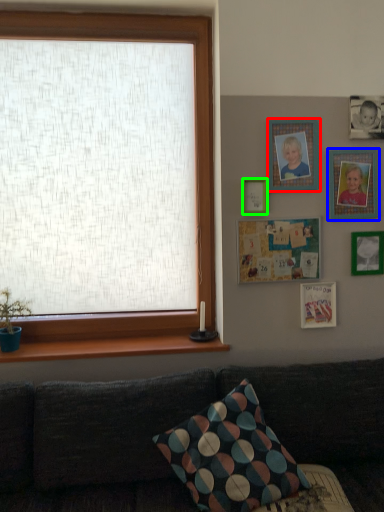
Question: Estimate the real-world distances between objects in this image. Which object is closer to picture frame (highlighted by a red box), picture frame (highlighted by a blue box) or picture frame (highlighted by a green box)?

Choices:
 (A) picture frame
 (B) picture frame

Answer: (B)